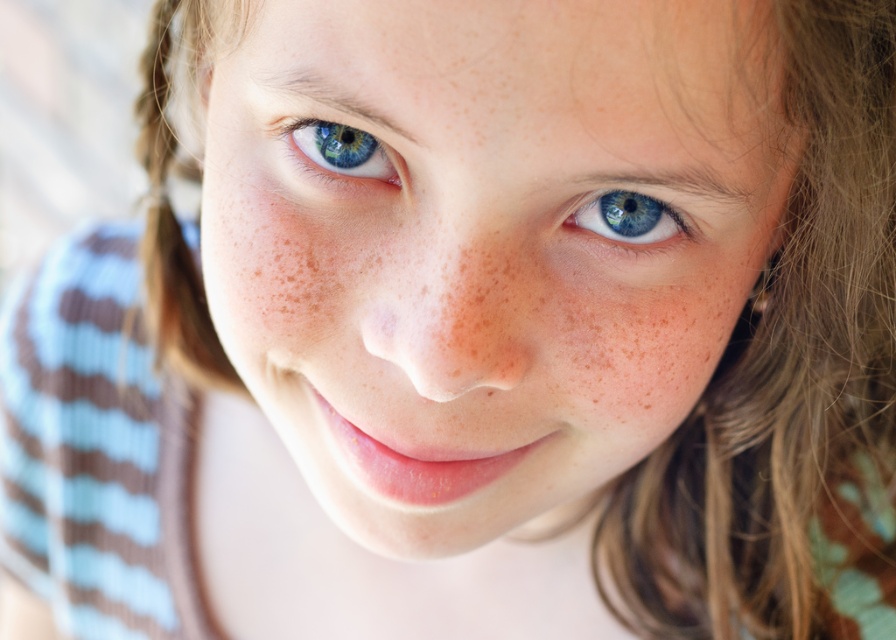
You are a photographer adjusting the lighting for a portrait. You notice the smooth skin face at center and the blue glossy eye at upper left. Which object is positioned to the right of the other?

The smooth skin face at center is to the right of blue glossy eye at upper left.

You are a photographer adjusting the focus on your camera. You notice two points in the image at coordinates point (317, 189) and point (378, 170). Which point is closer to the camera lens?

Point (317, 189) is further to the camera than point (378, 170), so the point closer to the camera lens is point (378, 170).

Based on the scene description, can you determine which object is taller between the smooth skin face at center and the blue glossy eye at upper left?

A: The smooth skin face at center is taller than the blue glossy eye at upper left according to the description.